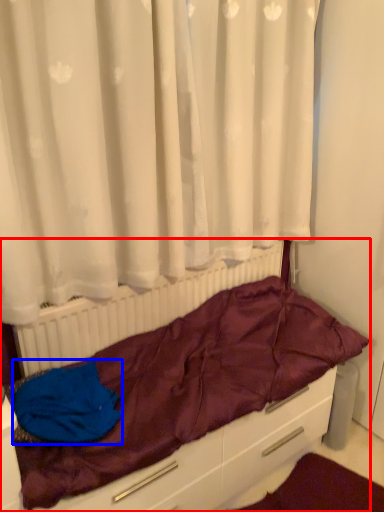
Question: Which object is closer to the camera taking this photo, furniture (highlighted by a red box) or material (highlighted by a blue box)?

Choices:
 (A) furniture
 (B) material

Answer: (A)